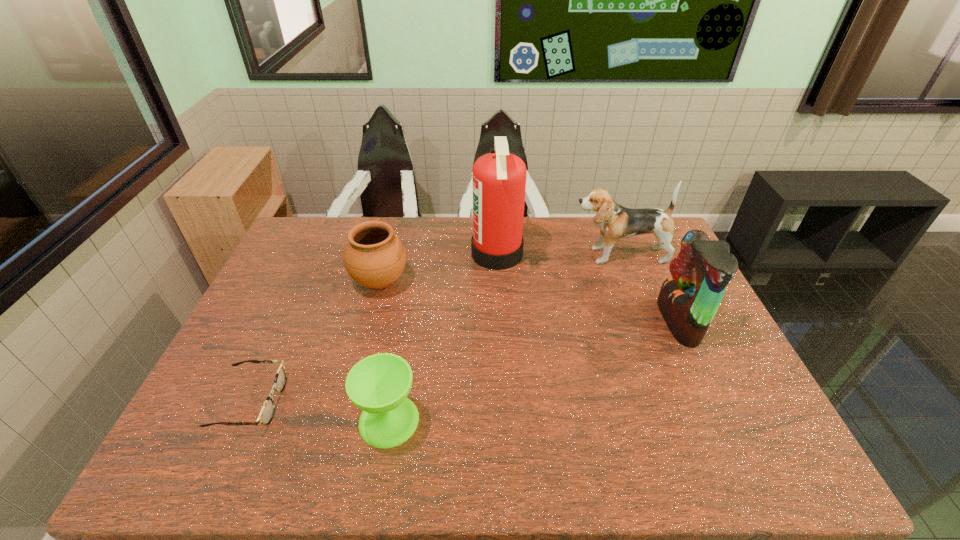
I want to click on vacant space in between the pottery and the parrot, so click(x=529, y=302).

Identify which object is the fifth closest to the pottery. Please provide its 2D coordinates. Your answer should be formatted as a tuple, i.e. [(x, y)], where the tuple contains the x and y coordinates of a point satisfying the conditions above.

[(688, 300)]

The width and height of the screenshot is (960, 540). Identify the location of the closest object relative to the third shortest object. (499, 178).

Locate an element on the screen. The height and width of the screenshot is (540, 960). vacant point that satisfies the following two spatial constraints: 1. on the front side of the third shortest object; 2. on the left side of the wineglass is located at coordinates (345, 420).

You are a GUI agent. You are given a task and a screenshot of the screen. Output one action in this format:
    pyautogui.click(x=<x>, y=<y>)
    Task: Click on the vacant area in the image that satisfies the following two spatial constraints: 1. on the frame of the fifth tallest object; 2. on the right side of the leftmost object
    
    Given the screenshot: What is the action you would take?
    pyautogui.click(x=242, y=420)